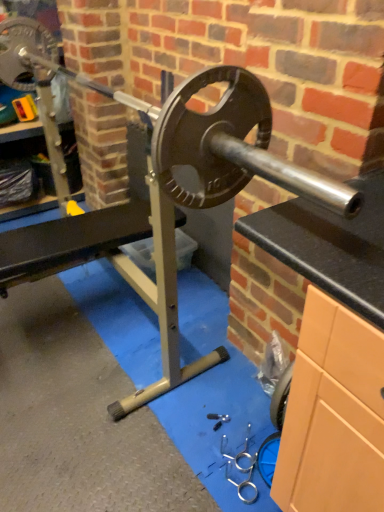
This screenshot has width=384, height=512. Describe the element at coordinates (188, 129) in the screenshot. I see `polished silver barbell at center` at that location.

In order to click on polished silver barbell at center in this screenshot , I will do `click(188, 129)`.

This screenshot has height=512, width=384. I want to click on polished silver barbell at center, so click(188, 129).